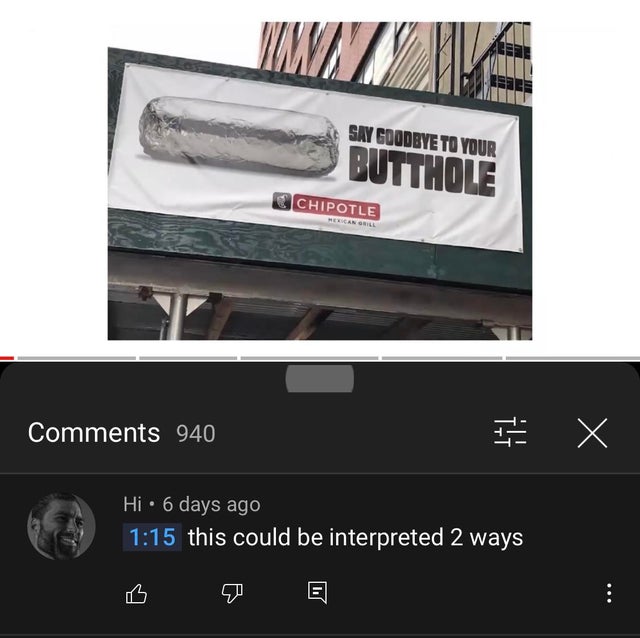
I want to click on windows, so click(332, 61), click(317, 33), click(300, 27).